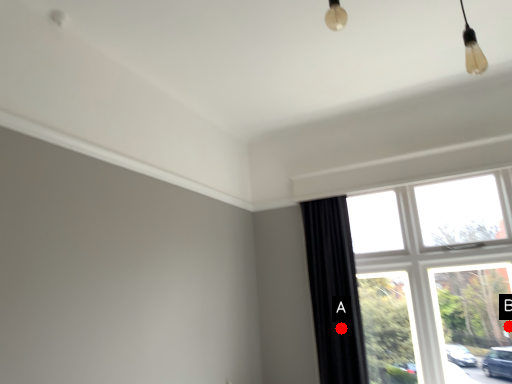
Question: Two points are circled on the image, labeled by A and B beside each circle. Which point is closer to the camera?

Choices:
 (A) A is closer
 (B) B is closer

Answer: (B)